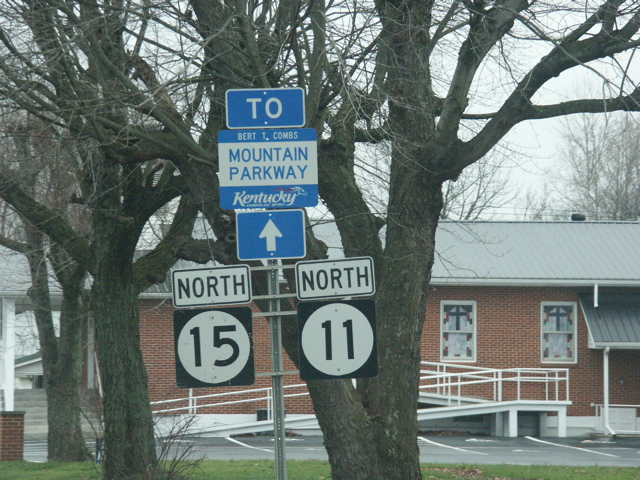
Image resolution: width=640 pixels, height=480 pixels. What are the coordinates of `brick walls` in the screenshot? It's located at (11, 439), (155, 345), (520, 318), (627, 360), (575, 395).